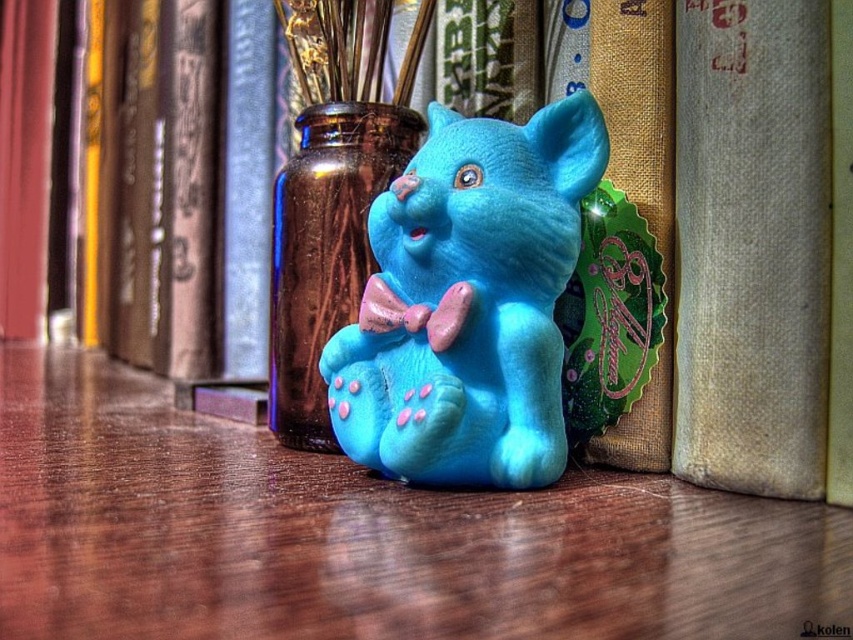
Question: Which point appears farthest from the camera in this image?

Choices:
 (A) (791, 230)
 (B) (358, 314)
 (C) (512, 588)

Answer: (B)

Question: Which object is farther from the camera taking this photo?

Choices:
 (A) matte blue plush cat at center
 (B) beige textured book at center
 (C) matte wooden table at center

Answer: (A)

Question: Is matte blue plush cat at center further to camera compared to beige textured book at center?

Choices:
 (A) yes
 (B) no

Answer: (A)

Question: Can you confirm if matte wooden table at center is wider than matte blue plush cat at center?

Choices:
 (A) no
 (B) yes

Answer: (B)

Question: Which of the following is the farthest from the observer?

Choices:
 (A) (386, 474)
 (B) (824, 604)

Answer: (A)

Question: Where is matte wooden table at center located in relation to matte blue plush cat at center in the image?

Choices:
 (A) above
 (B) below

Answer: (B)